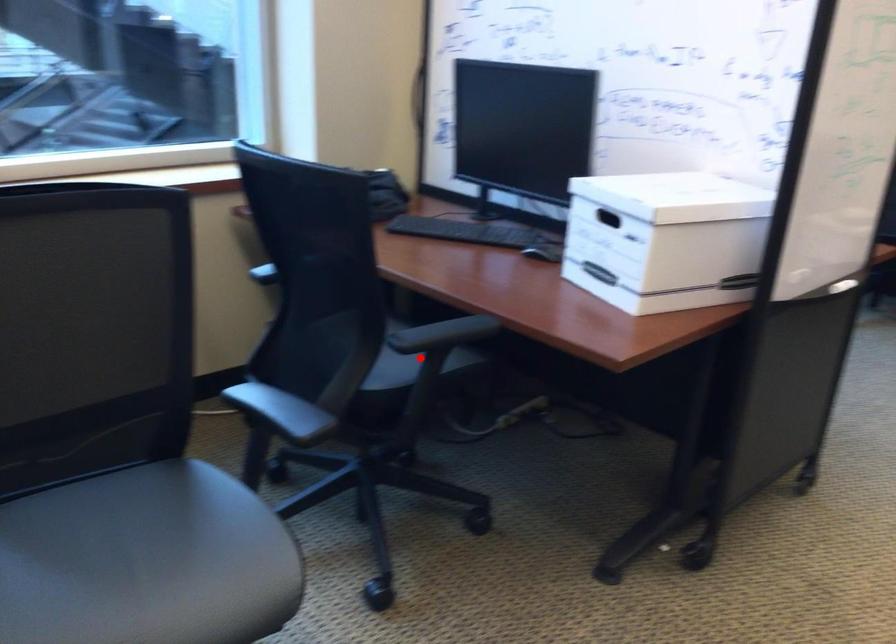
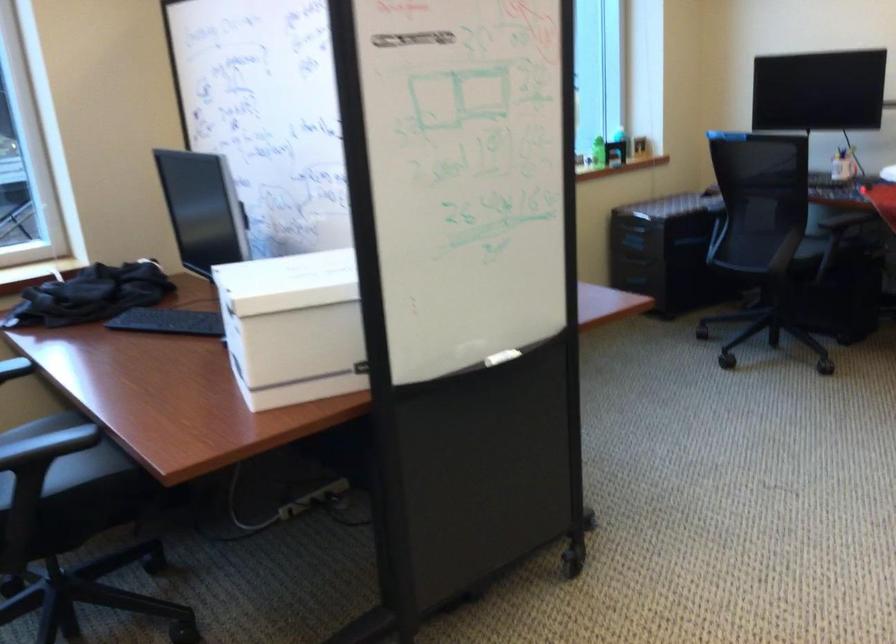
Locate, in the second image, the point that corresponds to the highlighted location in the first image.

(65, 464)